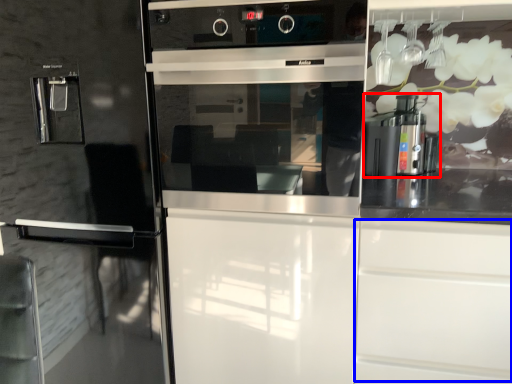
Question: Among these objects, which one is nearest to the camera, coffee machine (highlighted by a red box) or drawer (highlighted by a blue box)?

Choices:
 (A) coffee machine
 (B) drawer

Answer: (B)